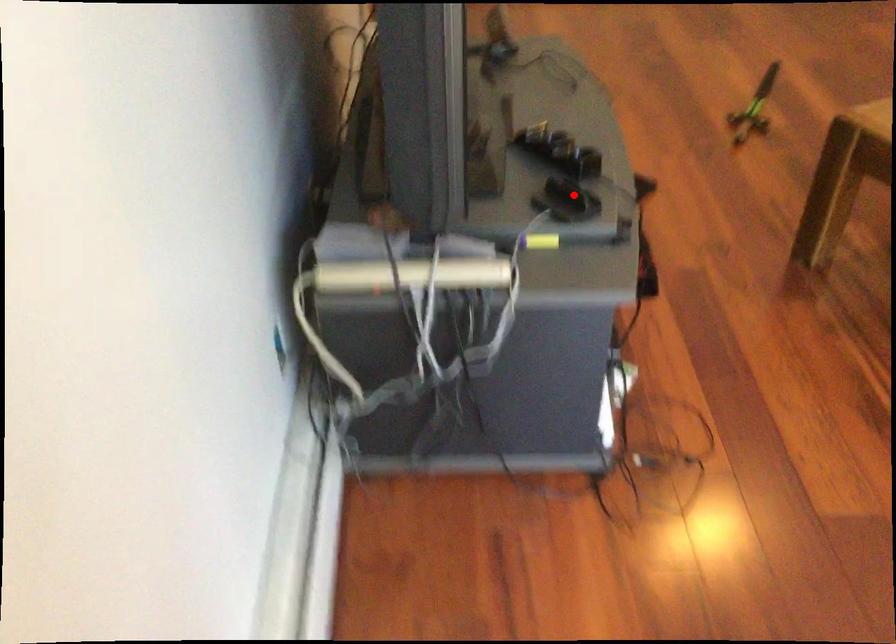
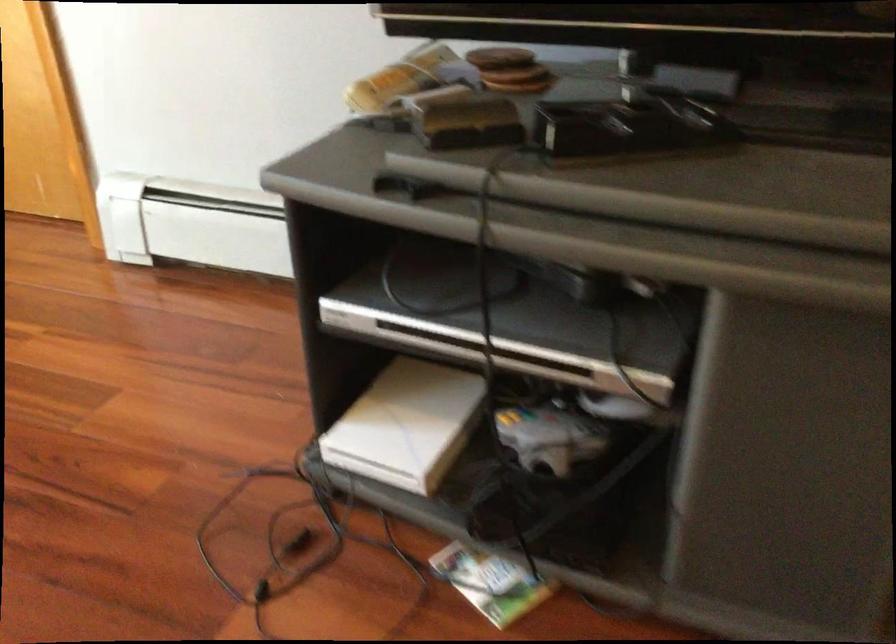
The point at the highlighted location is marked in the first image. Where is the corresponding point in the second image?

(469, 124)